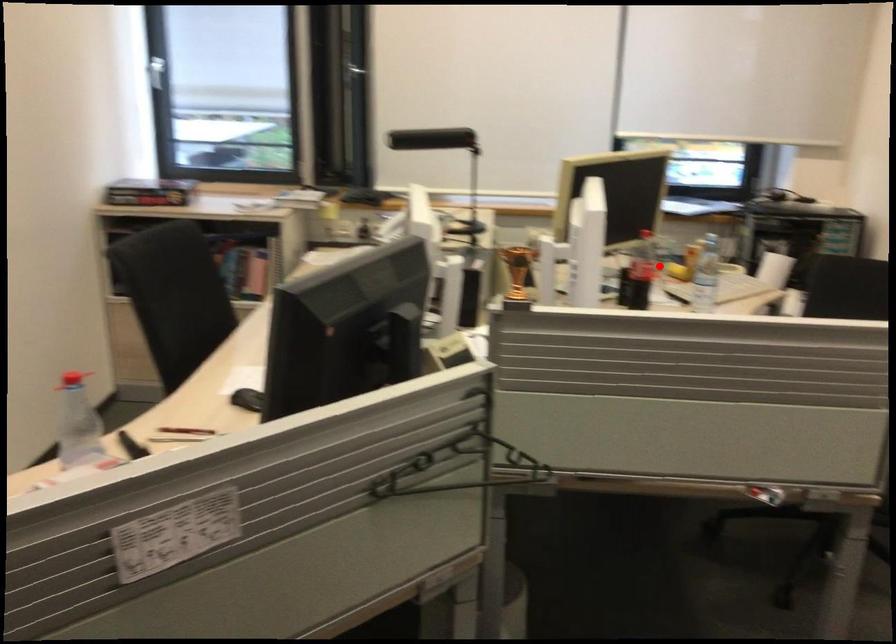
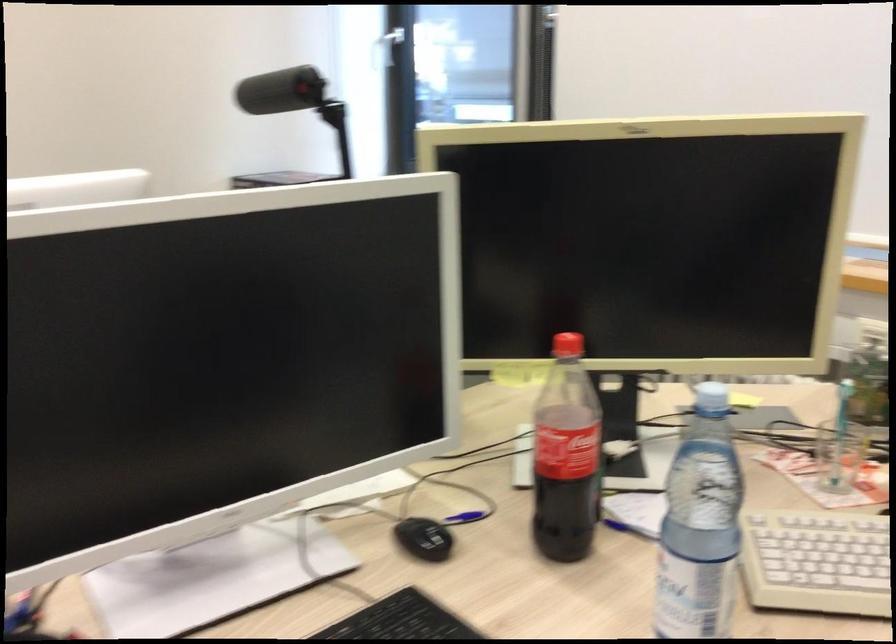
Question: I am providing you with two images of the same scene from different viewpoints. A red point is shown in image1. For the corresponding object point in image2, is it positioned nearer or farther from the camera?

Choices:
 (A) Nearer
 (B) Farther

Answer: (A)